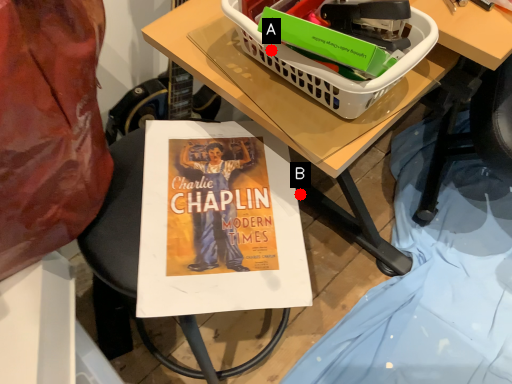
Question: Two points are circled on the image, labeled by A and B beside each circle. Which point is further to the camera?

Choices:
 (A) A is further
 (B) B is further

Answer: (B)